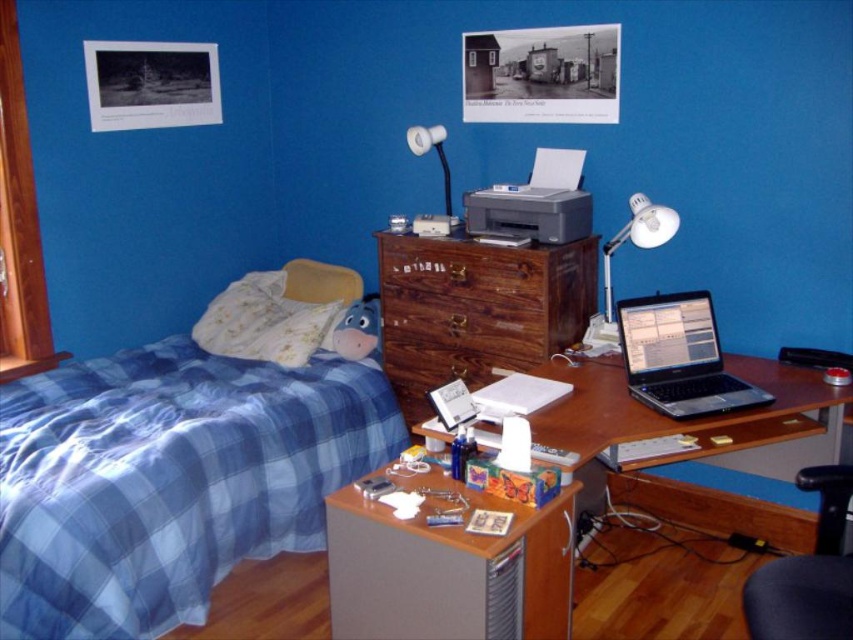
Question: Can you confirm if blue plaid fabric bed at left is bigger than brown wood drawer at center?

Choices:
 (A) no
 (B) yes

Answer: (B)

Question: Does matte brown file cabinet at lower center have a larger size compared to silver metallic printer at center?

Choices:
 (A) no
 (B) yes

Answer: (B)

Question: Which point appears closest to the camera in this image?

Choices:
 (A) (445, 180)
 (B) (809, 618)

Answer: (B)

Question: Which object appears farthest from the camera in this image?

Choices:
 (A) white plastic desk lamp at upper right
 (B) satin black laptop at center right

Answer: (A)

Question: From the image, what is the correct spatial relationship of brown wood drawer at center in relation to matte plastic desk lamp at upper center?

Choices:
 (A) left
 (B) right

Answer: (B)

Question: Based on their relative distances, which object is nearer to the matte brown file cabinet at lower center?

Choices:
 (A) satin black laptop at center right
 (B) brown wood drawer at center
 (C) wooden desk at center

Answer: (C)